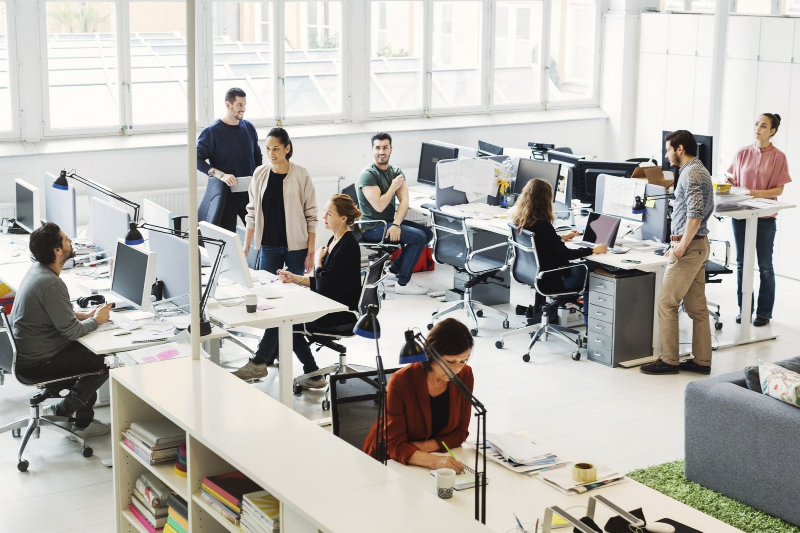
The height and width of the screenshot is (533, 800). I want to click on desk chairs, so click(26, 389), click(358, 411), click(345, 335), click(373, 239), click(468, 253), click(530, 266), click(726, 258).